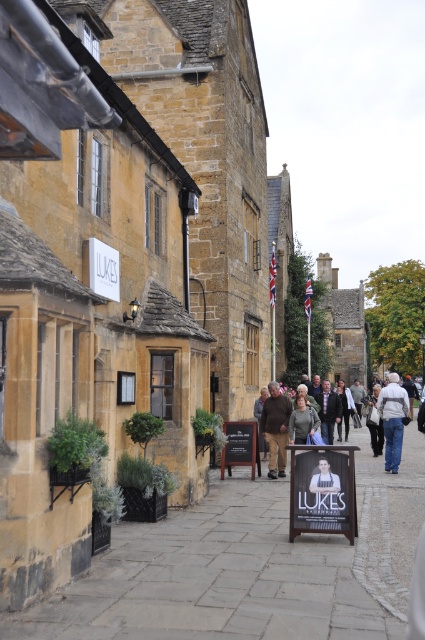
You are standing at the viewpoint of the image and want to walk to both points mentioned. Which point, point [85,630] or point [334,412], will you reach first?

You will reach point [85,630] first because it is closer to you than point [334,412].

Please describe the position of the light gray fabric jacket at center in terms of coordinates within the image. The image has a coordinate system where the bottom left corner is the origin point. The horizontal axis goes from left to right, and the vertical axis goes from bottom to top. The coordinates are given as a pair of numbers between 0 and 1. For example, the bottom left corner is at 0.0, 0.0, and the top right corner is at 1.0, 1.0. Please provide the coordinates as a tuple in the format of x,y.

The light gray fabric jacket at center is located at coordinates [393,419].

You are a delivery person carrying a package that requires a 3 meter minimum distance to avoid damaging it. You see a light gray fabric jacket at center and a dark gray sweater at center in the scene. Can you safely place the package between them without causing damage?

The light gray fabric jacket at center is 2.94 meters from the dark gray sweater at center. Since the required minimum distance is 3 meters, placing the package between them would not meet the safety requirement, so it is not safe to do so.